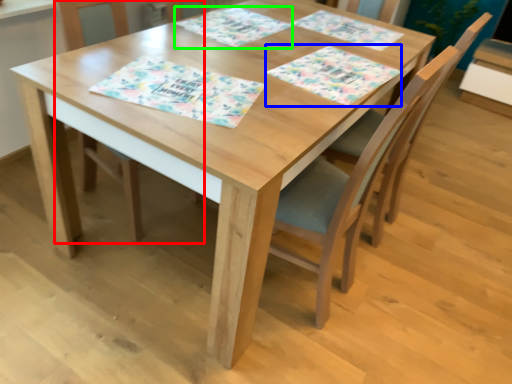
Question: Which is nearer to the chair (highlighted by a red box)? place mat (highlighted by a blue box) or place mat (highlighted by a green box).

Choices:
 (A) place mat
 (B) place mat

Answer: (B)